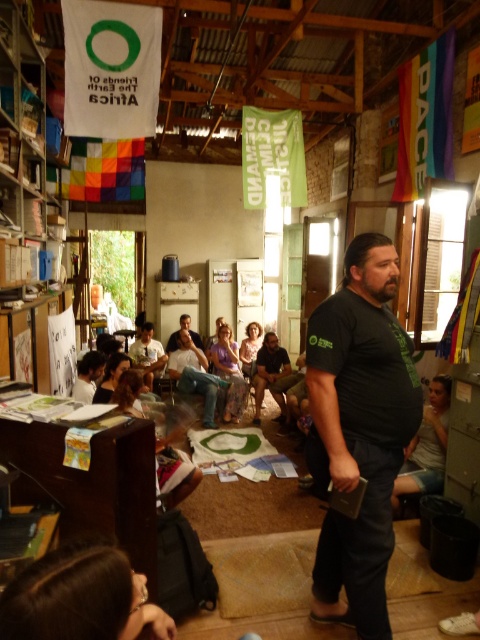
In order to click on black matte shirt at center in this screenshot , I will do click(359, 429).

Does black matte shirt at center appear on the right side of light brown leather jacket at center?

Correct, you'll find black matte shirt at center to the right of light brown leather jacket at center.

This screenshot has height=640, width=480. I want to click on black matte shirt at center, so click(x=359, y=429).

Find the location of a particular element. black matte shirt at center is located at coordinates (359, 429).

Does black matte shirt at center have a greater height compared to matte black shirt at center?

Yes.

Where is `black matte shirt at center`? Image resolution: width=480 pixels, height=640 pixels. black matte shirt at center is located at coordinates (359, 429).

Is point (371, 538) behind point (253, 419)?

No.

Where is `black matte shirt at center`? The height and width of the screenshot is (640, 480). black matte shirt at center is located at coordinates (359, 429).

Which is more to the left, light brown leather jacket at center or matte black shirt at center?

light brown leather jacket at center

Where is `light brown leather jacket at center`? light brown leather jacket at center is located at coordinates (194, 376).

Between point (194, 376) and point (263, 364), which one is positioned in front?

Point (194, 376) is in front.

The width and height of the screenshot is (480, 640). I want to click on light brown leather jacket at center, so click(194, 376).